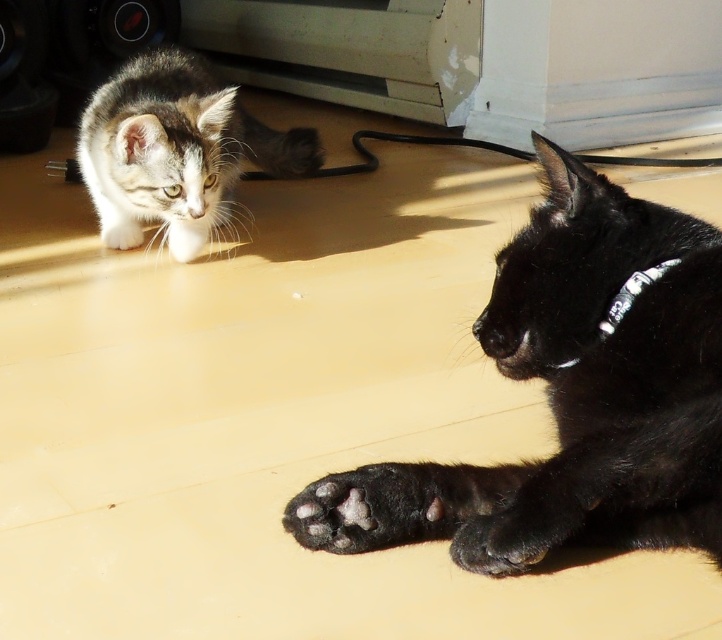
Question: Does tabby fur kitten at upper left appear under black fabric neckband at lower right?

Choices:
 (A) no
 (B) yes

Answer: (A)

Question: Which of these objects is positioned closest to the black soft paw at lower center?

Choices:
 (A) tabby fur kitten at upper left
 (B) black fabric neckband at lower right
 (C) white fur paw at center

Answer: (B)

Question: Does tabby fur kitten at upper left have a larger size compared to white printed fabric at center?

Choices:
 (A) no
 (B) yes

Answer: (B)

Question: In this image, where is tabby fur kitten at upper left located relative to white fur paw at center?

Choices:
 (A) below
 (B) above

Answer: (B)

Question: Which point is closer to the camera?

Choices:
 (A) black fur paw at lower right
 (B) black soft paw at lower center

Answer: (A)

Question: Which is farther from the black fabric neckband at lower right?

Choices:
 (A) tabby fur kitten at upper left
 (B) white fur paw at center

Answer: (A)